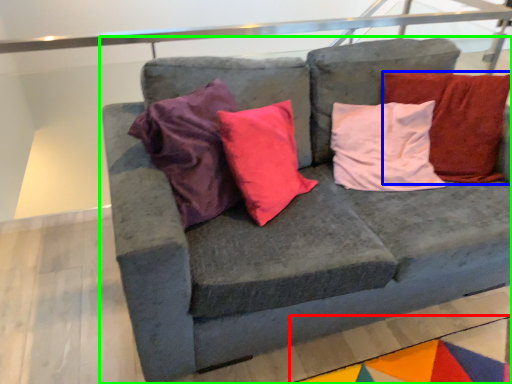
Question: Which object is the farthest from mat (highlighted by a red box)? Choose among these: pillow (highlighted by a blue box) or studio couch (highlighted by a green box).

Choices:
 (A) pillow
 (B) studio couch

Answer: (A)